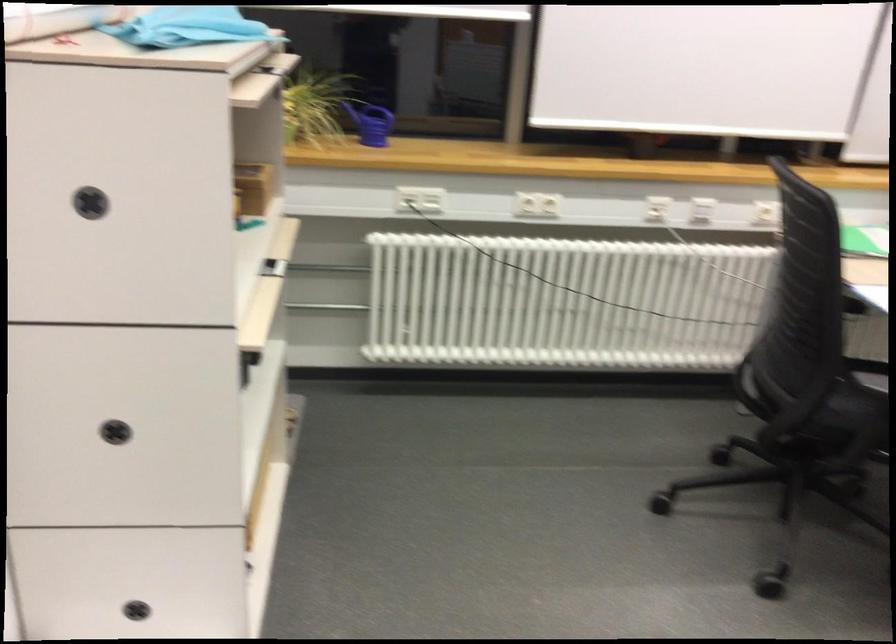
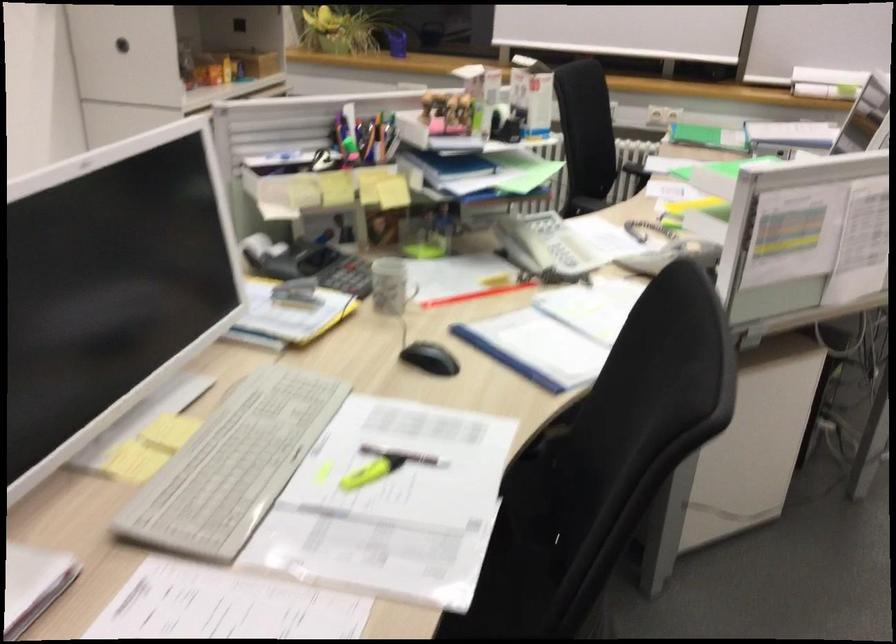
Question: I am providing you with two images of the same scene from different viewpoints. Which of the following objects are not visible in image2?

Choices:
 (A) metal ladder rung
 (B) black stapler
 (C) black calculator
 (D) white power outlet

Answer: (D)